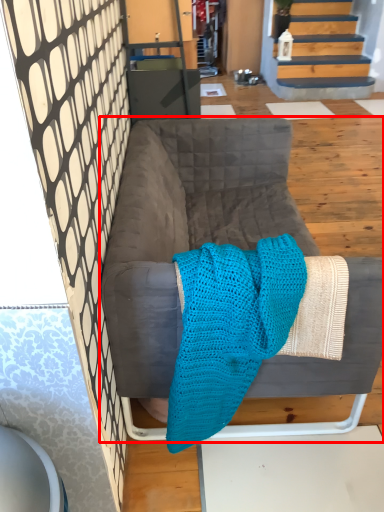
Question: Observing the image, what is the correct spatial positioning of furniture (annotated by the red box) in reference to cloth?

Choices:
 (A) left
 (B) right

Answer: (B)